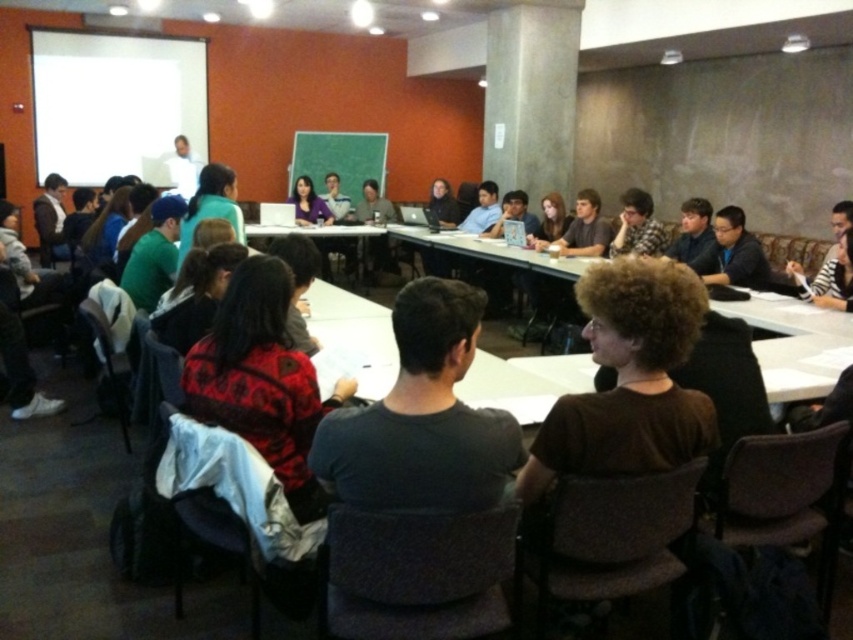
Question: Which object is positioned farthest from the red sweater at center?

Choices:
 (A) brown hair at center
 (B) white plastic table at center

Answer: (B)

Question: Can you confirm if matte black shirt at center is thinner than brown hair at center?

Choices:
 (A) no
 (B) yes

Answer: (B)

Question: Does red sweater at center have a smaller size compared to dark gray shirt at center?

Choices:
 (A) yes
 (B) no

Answer: (B)

Question: Estimate the real-world distances between objects in this image. Which object is farther from the matte purple shirt at center?

Choices:
 (A) dark gray shirt at center
 (B) red sweater at center
 (C) white plastic table at center

Answer: (B)

Question: Among these points, which one is nearest to the camera?

Choices:
 (A) (310, 189)
 (B) (582, 216)
 (C) (665, 241)

Answer: (C)

Question: Observing the image, what is the correct spatial positioning of dark gray shirt at center in reference to matte black shirt at center?

Choices:
 (A) above
 (B) below

Answer: (B)